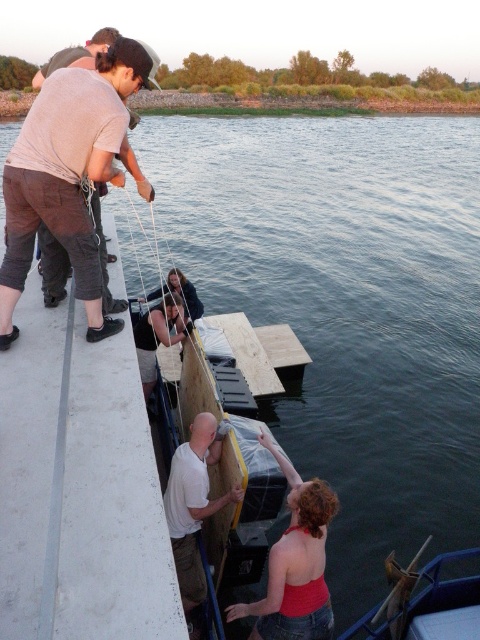
This screenshot has width=480, height=640. I want to click on matte gray shirt at left, so click(x=69, y=173).

Does matte gray shirt at left appear over white matte shirt at lower center?

Indeed, matte gray shirt at left is positioned over white matte shirt at lower center.

Locate an element on the screen. The image size is (480, 640). matte gray shirt at left is located at coordinates (69, 173).

Find the location of a particular element. matte gray shirt at left is located at coordinates (69, 173).

Where is `wooden boat at lower right`? The width and height of the screenshot is (480, 640). wooden boat at lower right is located at coordinates (427, 605).

Between point (456, 600) and point (148, 349), which one is positioned in front?

Point (456, 600) is more forward.

At what (x,y) coordinates should I click in order to perform the action: click on wooden boat at lower right. Please return your answer as a coordinate pair (x, y). Looking at the image, I should click on (427, 605).

Which of these two, red sleeveless top at lower right or matte black shirt at center, stands shorter?

matte black shirt at center

Is red sleeveless top at lower right below matte black shirt at center?

Yes, red sleeveless top at lower right is below matte black shirt at center.

Where is `red sleeveless top at lower right`? red sleeveless top at lower right is located at coordinates (295, 564).